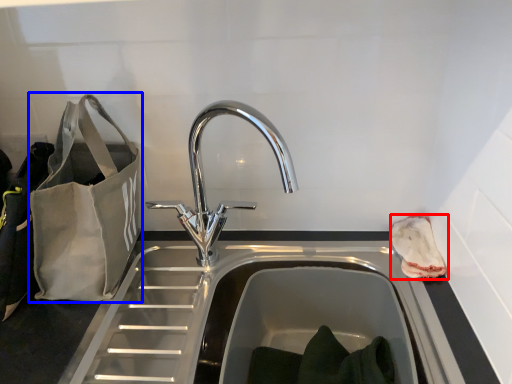
Question: Which point is closer to the camera, pouch (highlighted by a red box) or bag (highlighted by a blue box)?

Choices:
 (A) pouch
 (B) bag

Answer: (B)